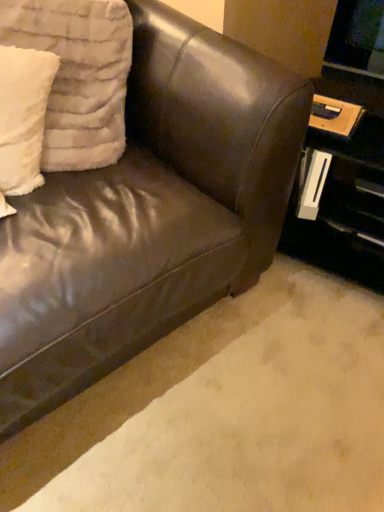
What do you see at coordinates (225, 412) in the screenshot? Image resolution: width=384 pixels, height=512 pixels. I see `brown leather couch at lower left` at bounding box center [225, 412].

The width and height of the screenshot is (384, 512). What do you see at coordinates (342, 192) in the screenshot?
I see `matte black table at right` at bounding box center [342, 192].

I want to click on brown leather couch at upper left, so click(x=149, y=214).

Describe the element at coordinates (78, 75) in the screenshot. I see `white fluffy pillow at upper left, acting as the second pillow starting from the left` at that location.

Find the location of a particular element. The height and width of the screenshot is (512, 384). brown leather couch at lower left is located at coordinates (225, 412).

Between white fluffy pillow at upper left, which is the first pillow in right-to-left order, and matte black table at right, which one appears on the left side from the viewer's perspective?

white fluffy pillow at upper left, which is the first pillow in right-to-left order.

Based on their sizes in the image, would you say white fluffy pillow at upper left, acting as the second pillow starting from the left, is bigger or smaller than matte black table at right?

white fluffy pillow at upper left, acting as the second pillow starting from the left, is smaller than matte black table at right.

This screenshot has height=512, width=384. I want to click on table below the white fluffy pillow at upper left, acting as the second pillow starting from the left (from a real-world perspective), so click(x=342, y=192).

From the picture: From the image's perspective, which is below, white fluffy pillow at upper left, acting as the second pillow starting from the left, or matte black table at right?

From the image's view, matte black table at right is below.

How many degrees apart are the facing directions of white fluffy pillow at upper left, acting as the second pillow starting from the left, and brown leather couch at lower left?

The angular difference between white fluffy pillow at upper left, acting as the second pillow starting from the left, and brown leather couch at lower left is 31.7 degrees.

Is white fluffy pillow at upper left, which is the first pillow in right-to-left order, looking in the opposite direction of brown leather couch at lower left?

No, white fluffy pillow at upper left, which is the first pillow in right-to-left order,'s orientation is not away from brown leather couch at lower left.

Considering the relative sizes of white fluffy pillow at upper left, which is the first pillow in right-to-left order, and brown leather couch at lower left in the image provided, is white fluffy pillow at upper left, which is the first pillow in right-to-left order, bigger than brown leather couch at lower left?

Indeed, white fluffy pillow at upper left, which is the first pillow in right-to-left order, has a larger size compared to brown leather couch at lower left.

Based on the photo, from a real-world perspective, is white fluffy pillow at upper left, which is the first pillow in right-to-left order, positioned above or below brown leather couch at lower left?

white fluffy pillow at upper left, which is the first pillow in right-to-left order, is situated higher than brown leather couch at lower left in the real world.

How much distance is there between matte black table at right and white fluffy pillow at upper left, acting as the second pillow starting from the left?

matte black table at right is 25.19 inches from white fluffy pillow at upper left, acting as the second pillow starting from the left.

Is matte black table at right situated inside white fluffy pillow at upper left, acting as the second pillow starting from the left, or outside?

matte black table at right lies outside white fluffy pillow at upper left, acting as the second pillow starting from the left.

From the image's perspective, starting from the matte black table at right, which pillow is the 2nd one above? Please provide its 2D coordinates.

[(78, 75)]

How many degrees apart are the facing directions of matte black table at right and white fluffy pillow at upper left, acting as the second pillow starting from the left?

The angle between the facing direction of matte black table at right and the facing direction of white fluffy pillow at upper left, acting as the second pillow starting from the left, is 37.9 degrees.

Considering the sizes of objects white fluffy pillow at upper left, acting as the second pillow starting from the left, and brown leather couch at upper left in the image provided, who is smaller, white fluffy pillow at upper left, acting as the second pillow starting from the left, or brown leather couch at upper left?

white fluffy pillow at upper left, acting as the second pillow starting from the left.

Could you measure the distance between white fluffy pillow at upper left, acting as the second pillow starting from the left, and brown leather couch at upper left?

The distance of white fluffy pillow at upper left, acting as the second pillow starting from the left, from brown leather couch at upper left is 9.43 inches.

Can you see white fluffy pillow at upper left, acting as the second pillow starting from the left, touching brown leather couch at upper left?

No, white fluffy pillow at upper left, acting as the second pillow starting from the left, is not beside brown leather couch at upper left.

Considering the relative sizes of white fluffy pillow at upper left, acting as the second pillow starting from the left, and brown leather couch at upper left in the image provided, is white fluffy pillow at upper left, acting as the second pillow starting from the left, shorter than brown leather couch at upper left?

Indeed, white fluffy pillow at upper left, acting as the second pillow starting from the left, has a lesser height compared to brown leather couch at upper left.

Does white fluffy pillow at upper left, the 2th pillow viewed from the right, have a greater height compared to matte black table at right?

In fact, white fluffy pillow at upper left, the 2th pillow viewed from the right, may be shorter than matte black table at right.

The image size is (384, 512). What are the coordinates of `table behind the white fluffy pillow at upper left, the 2th pillow viewed from the right` in the screenshot? It's located at (342, 192).

Is white fluffy pillow at upper left, the 2th pillow viewed from the right, smaller than matte black table at right?

Yes, white fluffy pillow at upper left, the 2th pillow viewed from the right, is smaller than matte black table at right.

Is brown leather couch at upper left at the back of white fluffy pillow at upper left, the 2th pillow viewed from the right?

Yes, white fluffy pillow at upper left, the 2th pillow viewed from the right, is positioned with its back facing brown leather couch at upper left.

Which of these two, white fluffy pillow at upper left, the first pillow from the left, or brown leather couch at upper left, stands shorter?

white fluffy pillow at upper left, the first pillow from the left, is shorter.

Which is more to the left, white fluffy pillow at upper left, the first pillow from the left, or brown leather couch at upper left?

Positioned to the left is white fluffy pillow at upper left, the first pillow from the left.

Are white fluffy pillow at upper left, the first pillow from the left, and brown leather couch at upper left far apart?

white fluffy pillow at upper left, the first pillow from the left, is actually quite close to brown leather couch at upper left.

Between white fluffy pillow at upper left, the 2th pillow viewed from the right, and white fluffy pillow at upper left, which is the first pillow in right-to-left order, which one has smaller width?

white fluffy pillow at upper left, the 2th pillow viewed from the right, is thinner.

This screenshot has height=512, width=384. I want to click on pillow below the white fluffy pillow at upper left, acting as the second pillow starting from the left (from the image's perspective), so click(x=23, y=116).

Which is in front, point (53, 77) or point (112, 79)?

The point (53, 77) is in front.

Who is taller, white fluffy pillow at upper left, the first pillow from the left, or white fluffy pillow at upper left, acting as the second pillow starting from the left?

white fluffy pillow at upper left, acting as the second pillow starting from the left, is taller.

From a real-world perspective, which pillow is the 2nd one above the matte black table at right? Please provide its 2D coordinates.

[(78, 75)]

From the image's perspective, count 2nd pillows upward from the brown leather couch at lower left and point to it. Please provide its 2D coordinates.

[(78, 75)]

Considering their positions, is white fluffy pillow at upper left, acting as the second pillow starting from the left, positioned further to white fluffy pillow at upper left, the first pillow from the left, than brown leather couch at lower left?

The object further to white fluffy pillow at upper left, the first pillow from the left, is brown leather couch at lower left.

From the image, which object appears to be farther from brown leather couch at upper left, brown leather couch at lower left or matte black table at right?

Among the two, matte black table at right is located further to brown leather couch at upper left.

Consider the image. From the image, which object appears to be farther from white fluffy pillow at upper left, the 2th pillow viewed from the right, matte black table at right or brown leather couch at upper left?

matte black table at right is further to white fluffy pillow at upper left, the 2th pillow viewed from the right.

Considering their positions, is white fluffy pillow at upper left, which is the first pillow in right-to-left order, positioned further to matte black table at right than white fluffy pillow at upper left, the 2th pillow viewed from the right?

The object further to matte black table at right is white fluffy pillow at upper left, the 2th pillow viewed from the right.

Looking at the image, which one is located closer to matte black table at right, white fluffy pillow at upper left, the 2th pillow viewed from the right, or white fluffy pillow at upper left, acting as the second pillow starting from the left?

white fluffy pillow at upper left, acting as the second pillow starting from the left, is closer to matte black table at right.

Looking at the image, which one is located further to brown leather couch at lower left, matte black table at right or white fluffy pillow at upper left, the 2th pillow viewed from the right?

white fluffy pillow at upper left, the 2th pillow viewed from the right, is positioned further to the anchor brown leather couch at lower left.

Based on their spatial positions, is brown leather couch at upper left or matte black table at right closer to white fluffy pillow at upper left, the 2th pillow viewed from the right?

brown leather couch at upper left lies closer to white fluffy pillow at upper left, the 2th pillow viewed from the right, than the other object.

Which object lies further to the anchor point brown leather couch at upper left, matte black table at right or white fluffy pillow at upper left, acting as the second pillow starting from the left?

matte black table at right is positioned further to the anchor brown leather couch at upper left.

This screenshot has height=512, width=384. What are the coordinates of `pillow between brown leather couch at upper left and white fluffy pillow at upper left, the first pillow from the left, from front to back` in the screenshot? It's located at (78, 75).

At what (x,y) coordinates should I click in order to perform the action: click on studio couch between white fluffy pillow at upper left, acting as the second pillow starting from the left, and matte black table at right, in the horizontal direction. Please return your answer as a coordinate pair (x, y). The image size is (384, 512). Looking at the image, I should click on (149, 214).

At what (x,y) coordinates should I click in order to perform the action: click on table between white fluffy pillow at upper left, which is the first pillow in right-to-left order, and brown leather couch at lower left, in the vertical direction. Please return your answer as a coordinate pair (x, y). This screenshot has width=384, height=512. Looking at the image, I should click on (342, 192).

Identify the location of studio couch between white fluffy pillow at upper left, which is the first pillow in right-to-left order, and brown leather couch at lower left, in the vertical direction. (149, 214).